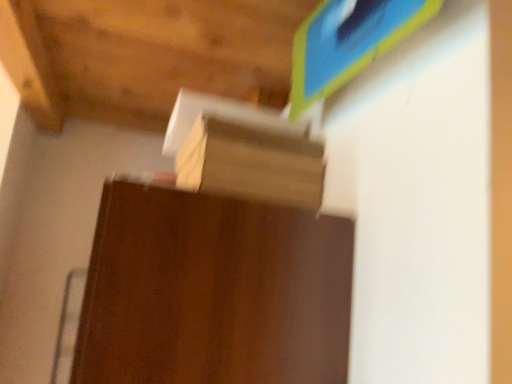
The height and width of the screenshot is (384, 512). What are the coordinates of `dark wood table at center` in the screenshot? It's located at (213, 292).

Measure the distance between point (161, 207) and camera.

Point (161, 207) is 31.26 inches from camera.

What do you see at coordinates (213, 292) in the screenshot?
I see `dark wood table at center` at bounding box center [213, 292].

The height and width of the screenshot is (384, 512). What do you see at coordinates (251, 162) in the screenshot? I see `brown cardboard at center` at bounding box center [251, 162].

What is the approximate width of brown cardboard at center?

brown cardboard at center is 13.33 inches wide.

Image resolution: width=512 pixels, height=384 pixels. Identify the location of brown cardboard at center. (251, 162).

I want to click on dark wood table at center, so click(213, 292).

Does brown cardboard at center appear on the right side of dark wood table at center?

Yes, brown cardboard at center is to the right of dark wood table at center.

Which object is further away from the camera, brown cardboard at center or dark wood table at center?

Positioned behind is brown cardboard at center.

Which point is more forward, (246, 180) or (184, 273)?

The point (184, 273) is closer.

From the image's perspective, relative to dark wood table at center, is brown cardboard at center above or below?

brown cardboard at center is above dark wood table at center.

From a real-world perspective, which object stands above the other?

brown cardboard at center is physically above.

Considering the sizes of brown cardboard at center and dark wood table at center in the image, is brown cardboard at center wider or thinner than dark wood table at center?

brown cardboard at center is thinner than dark wood table at center.

Between brown cardboard at center and dark wood table at center, which one has less height?

Standing shorter between the two is brown cardboard at center.

Based on their sizes in the image, would you say brown cardboard at center is bigger or smaller than dark wood table at center?

In the image, brown cardboard at center appears to be smaller than dark wood table at center.

Is brown cardboard at center positioned beyond the bounds of dark wood table at center?

That's correct, brown cardboard at center is outside of dark wood table at center.

Is brown cardboard at center directly adjacent to dark wood table at center?

No, brown cardboard at center is not touching dark wood table at center.

Is brown cardboard at center facing away from dark wood table at center?

No, brown cardboard at center is not facing away from dark wood table at center.

Can you tell me how much brown cardboard at center and dark wood table at center differ in facing direction?

6.71e-05 degrees.

Image resolution: width=512 pixels, height=384 pixels. I want to click on cardboard box on the right of dark wood table at center, so pyautogui.click(x=251, y=162).

Considering the relative positions of dark wood table at center and brown cardboard at center in the image provided, is dark wood table at center to the left or to the right of brown cardboard at center?

From the image, it's evident that dark wood table at center is to the left of brown cardboard at center.

Which is in front, dark wood table at center or brown cardboard at center?

dark wood table at center is more forward.

Which is behind, point (115, 317) or point (200, 186)?

The point (200, 186) is behind.

From the image's perspective, which object appears higher, dark wood table at center or brown cardboard at center?

brown cardboard at center, from the image's perspective.

From a real-world perspective, between dark wood table at center and brown cardboard at center, who is vertically lower?

dark wood table at center is physically lower.

Is dark wood table at center thinner than brown cardboard at center?

Incorrect, the width of dark wood table at center is not less than that of brown cardboard at center.

Is dark wood table at center shorter than brown cardboard at center?

In fact, dark wood table at center may be taller than brown cardboard at center.

Between dark wood table at center and brown cardboard at center, which one has larger size?

dark wood table at center is bigger.

Can brown cardboard at center be found inside dark wood table at center?

No, brown cardboard at center is not inside dark wood table at center.

Is dark wood table at center far from brown cardboard at center?

dark wood table at center is actually quite close to brown cardboard at center.

Is dark wood table at center facing towards brown cardboard at center?

No, dark wood table at center does not turn towards brown cardboard at center.

Can you tell me how much dark wood table at center and brown cardboard at center differ in facing direction?

6.71e-05 degrees separate the facing orientations of dark wood table at center and brown cardboard at center.

How distant is dark wood table at center from brown cardboard at center?

dark wood table at center is 10.36 inches away from brown cardboard at center.

You are a GUI agent. You are given a task and a screenshot of the screen. Output one action in this format:
    pyautogui.click(x=<x>, y=<y>)
    Task: Click on the cardboard box above the dark wood table at center (from the image's perspective)
    The image size is (512, 384).
    Given the screenshot: What is the action you would take?
    pyautogui.click(x=251, y=162)

Where is `cardboard box that is above the dark wood table at center (from a real-world perspective)`? The height and width of the screenshot is (384, 512). cardboard box that is above the dark wood table at center (from a real-world perspective) is located at coordinates (251, 162).

I want to click on furniture in front of the brown cardboard at center, so click(213, 292).